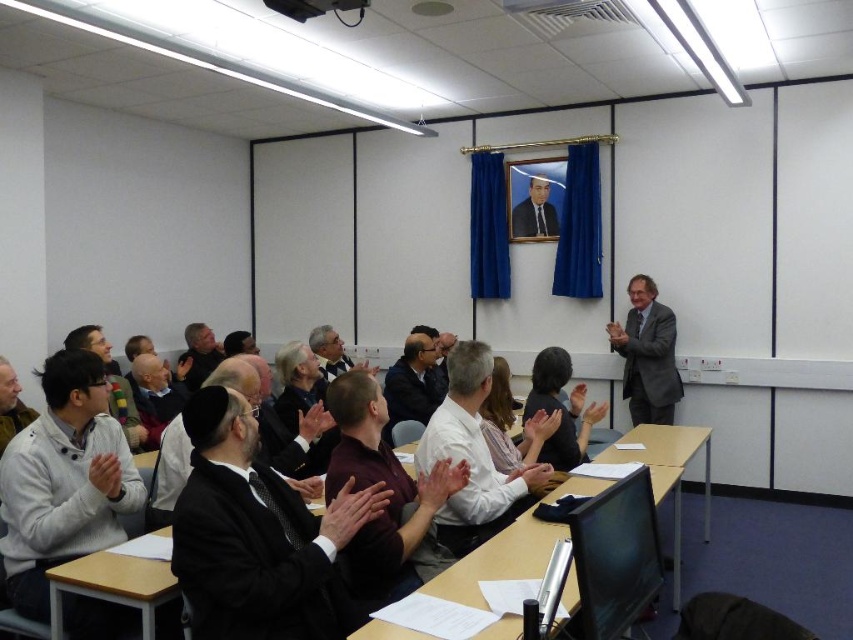
Question: Among these points, which one is nearest to the camera?

Choices:
 (A) (160, 602)
 (B) (538, 230)
 (C) (396, 541)

Answer: (A)

Question: Does black suit at center appear on the left side of wooden table at center?

Choices:
 (A) no
 (B) yes

Answer: (B)

Question: Which of the following is the closest to the observer?

Choices:
 (A) (553, 460)
 (B) (355, 365)
 (C) (85, 584)
 (D) (285, 528)

Answer: (D)

Question: Is formal black suit at upper center further to camera compared to dark gray suit at center?

Choices:
 (A) no
 (B) yes

Answer: (B)

Question: Does black suit at center have a smaller size compared to wooden table at center?

Choices:
 (A) no
 (B) yes

Answer: (B)

Question: Among these points, which one is farthest from the camera?

Choices:
 (A) (363, 365)
 (B) (395, 372)

Answer: (A)